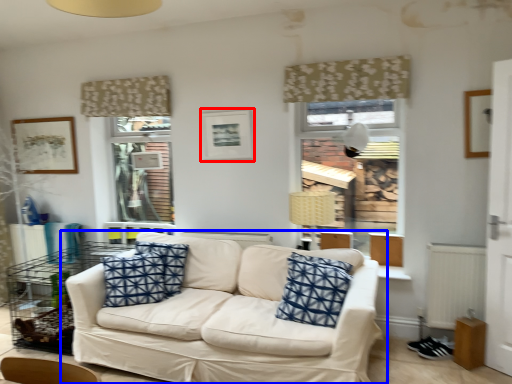
Question: Among these objects, which one is nearest to the camera, picture frame (highlighted by a red box) or studio couch (highlighted by a blue box)?

Choices:
 (A) picture frame
 (B) studio couch

Answer: (B)